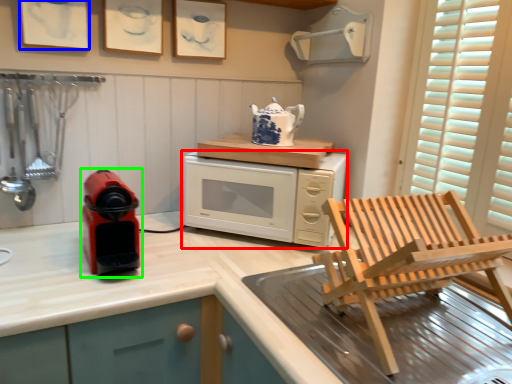
Question: Based on their relative distances, which object is nearer to microwave oven (highlighted by a red box)? Choose from picture frame (highlighted by a blue box) and home appliance (highlighted by a green box).

Choices:
 (A) picture frame
 (B) home appliance

Answer: (B)